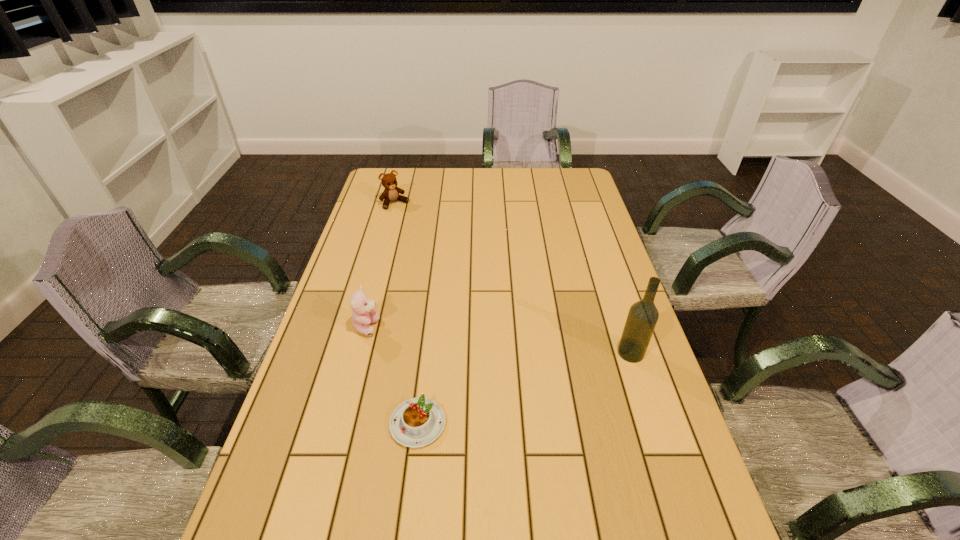
Where is `free space on the desktop that is between the pudding and the vodka and is positioned on the front-facing side of the farther teddy bear`? Image resolution: width=960 pixels, height=540 pixels. free space on the desktop that is between the pudding and the vodka and is positioned on the front-facing side of the farther teddy bear is located at coordinates (553, 379).

Find the location of a particular element. The image size is (960, 540). free spot on the desktop that is between the shortest object and the rightmost object and is positioned at the face of the third nearest object is located at coordinates pyautogui.click(x=517, y=390).